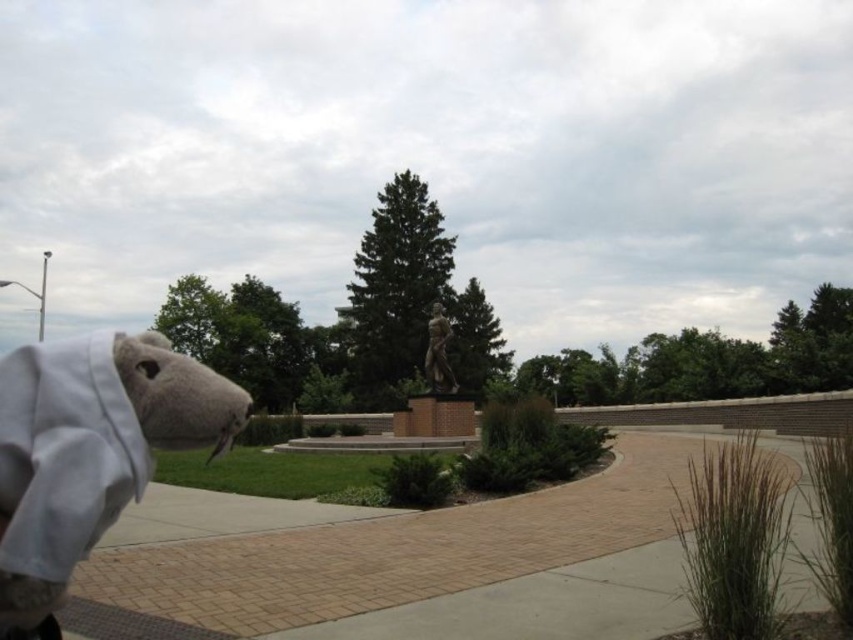
Question: Does brick pavement at center have a greater width compared to white plush toy at left?

Choices:
 (A) yes
 (B) no

Answer: (A)

Question: Which point is farther to the camera?

Choices:
 (A) (434, 333)
 (B) (485, 637)

Answer: (A)

Question: Can you confirm if brick pavement at center is positioned to the left of white plush toy at left?

Choices:
 (A) yes
 (B) no

Answer: (B)

Question: Which object appears farthest from the camera in this image?

Choices:
 (A) bronze statue at center
 (B) white plush toy at left
 (C) brick pavement at center

Answer: (A)

Question: Which point is closer to the camera?

Choices:
 (A) white plush toy at left
 (B) bronze statue at center
 (C) brick pavement at center

Answer: (A)

Question: Considering the relative positions of white plush toy at left and bronze statue at center in the image provided, where is white plush toy at left located with respect to bronze statue at center?

Choices:
 (A) below
 (B) above

Answer: (A)